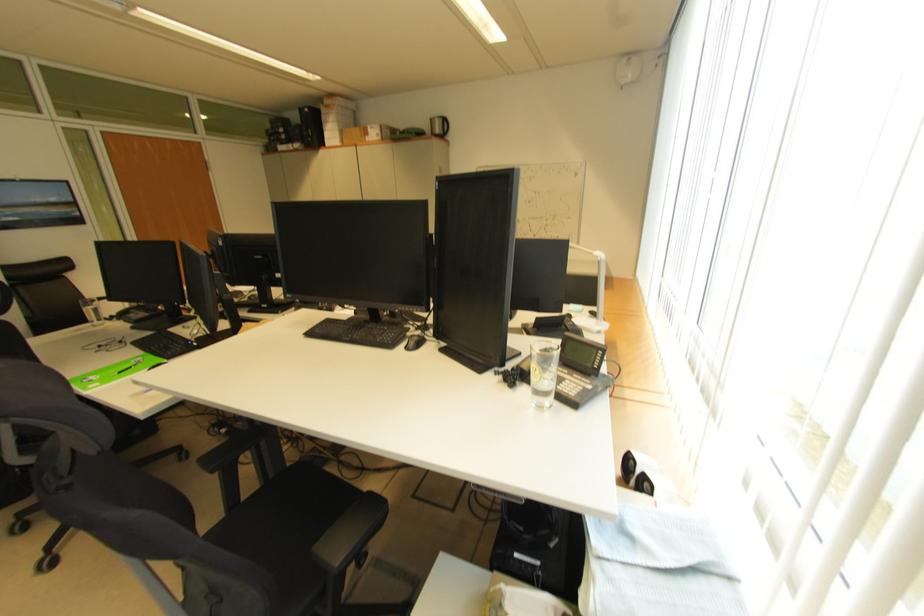
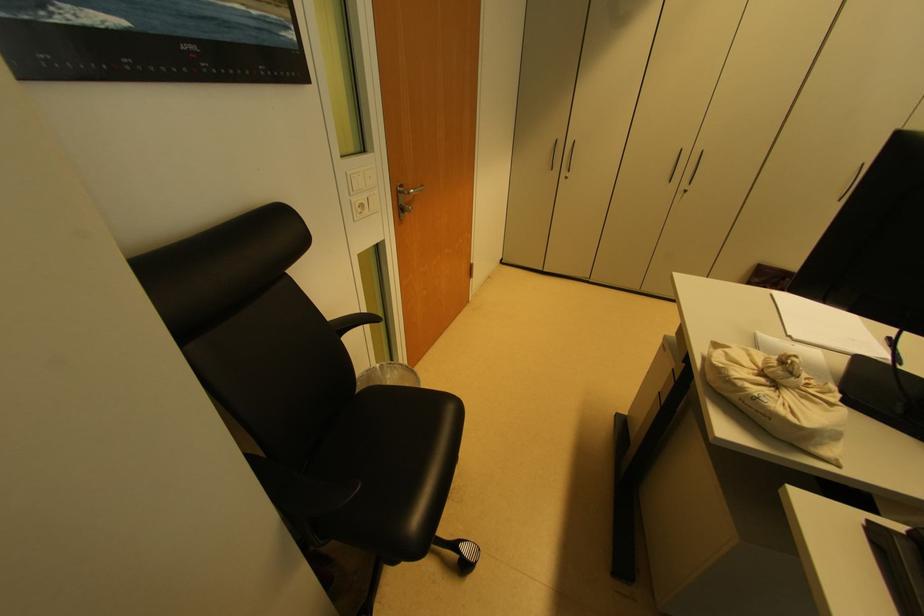
Which direction would the cameraman need to move to produce the second image?

The movement direction of the cameraman is left, forward.